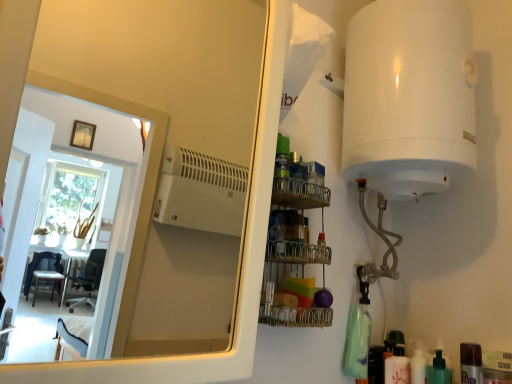
Question: Considering the positions of green matte pump bottle at lower right, arranged as the 2th toiletry when viewed from the right, and white glossy bottle at lower right, the third toiletry from the right, in the image, is green matte pump bottle at lower right, arranged as the 2th toiletry when viewed from the right, bigger or smaller than white glossy bottle at lower right, the third toiletry from the right,?

Choices:
 (A) big
 (B) small

Answer: (A)

Question: Visually, is green matte pump bottle at lower right, arranged as the 2th toiletry when viewed from the right, positioned to the left or to the right of white glossy bottle at lower right, the third toiletry from the right?

Choices:
 (A) left
 (B) right

Answer: (B)

Question: Estimate the real-world distances between objects in this image. Which object is farther from the green matte pump bottle at lower right, which is the 3th toiletry in left-to-right order?

Choices:
 (A) white glossy bottle at lower right, the third toiletry from the right
 (B) metallic wire rack at center
 (C) translucent plastic bottle at lower right, the fourth toiletry from the right
 (D) white glossy mirror at upper left
 (E) translucent plastic bottle at lower right, the 1th toiletry positioned from the right

Answer: (D)

Question: Which of these objects is positioned closest to the white glossy bottle at lower right, the second toiletry positioned from the left?

Choices:
 (A) green matte pump bottle at lower right, which is the 3th toiletry in left-to-right order
 (B) white glossy mirror at upper left
 (C) metallic wire rack at center
 (D) translucent plastic bottle at lower right, the 1th toiletry positioned from the right
 (E) translucent plastic bottle at lower right, the fourth toiletry from the right

Answer: (E)